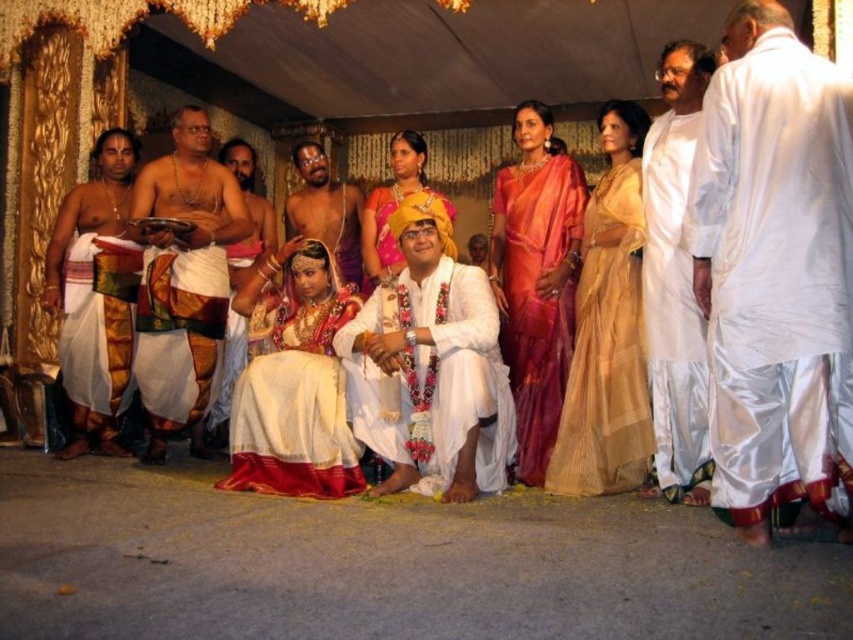
In the scene shown: You are a guest at the wedding and want to take a photo of the bride wearing the white silk saree at center and the groom in his attire. Since there are two silk sarees at center, how do you position yourself to capture both in the frame?

The white silk saree at center is located below the silk saree at center, so you should position yourself to include both the upper and lower parts of the central area to capture both the bride in the white silk saree at center and the groom in his attire.

You are attending a traditional South Indian Brahmin wedding and notice two points in the scene. The first point is at coordinate point (250, 484) and the second is at point (115, 397). Which of these two points is closer to you as you look at the scene?

Point (250, 484) is closer to the viewer than point (115, 397) according to the description.